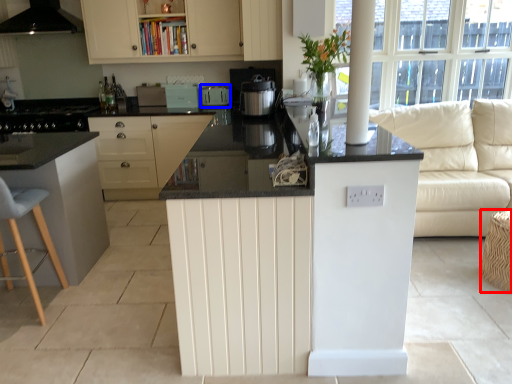
Question: Which object appears farthest to the camera in this image, bar stool (highlighted by a red box) or appliance (highlighted by a blue box)?

Choices:
 (A) bar stool
 (B) appliance

Answer: (B)